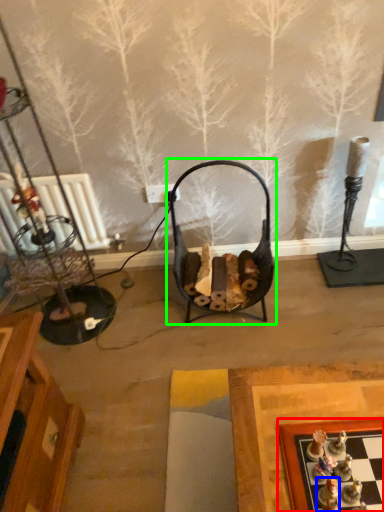
Question: Which object is positioned closest to board game (highlighted by a red box)? Select from toy (highlighted by a blue box) and swivel chair (highlighted by a green box).

Choices:
 (A) toy
 (B) swivel chair

Answer: (A)